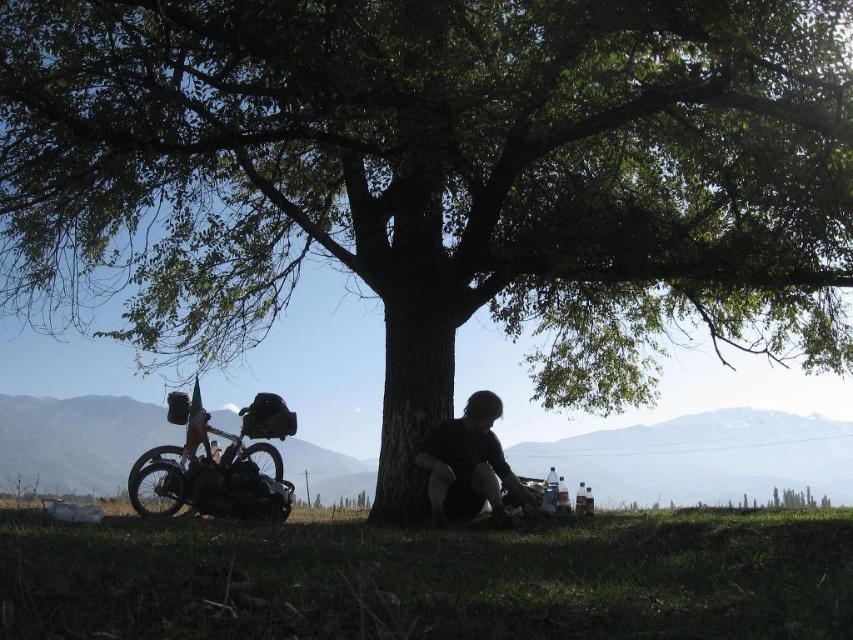
Does green grass at lower center come in front of silver metallic bicycle at left?

Yes, green grass at lower center is in front of silver metallic bicycle at left.

Does point (572, 632) come behind point (254, 408)?

No, (572, 632) is closer to viewer.

Locate an element on the screen. This screenshot has width=853, height=640. green grass at lower center is located at coordinates (430, 579).

Which is below, green grass at lower center or black matte shirt at lower center?

black matte shirt at lower center is below.

Is point (228, 596) positioned after point (436, 509)?

No, it is in front of (436, 509).

The height and width of the screenshot is (640, 853). Find the location of `green grass at lower center`. green grass at lower center is located at coordinates (430, 579).

Does silver metallic bicycle at left come in front of black matte shirt at lower center?

No, it is behind black matte shirt at lower center.

Which is behind, point (291, 486) or point (451, 497)?

Positioned behind is point (291, 486).

Is point (239, 458) farther from viewer compared to point (445, 464)?

Yes, it is.

This screenshot has height=640, width=853. In order to click on silver metallic bicycle at left in this screenshot , I will do `click(219, 461)`.